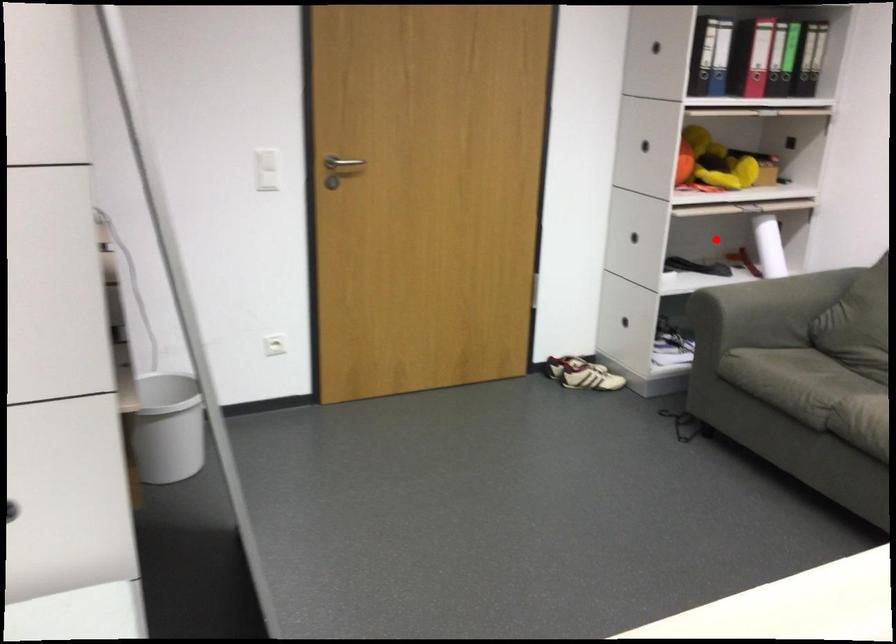
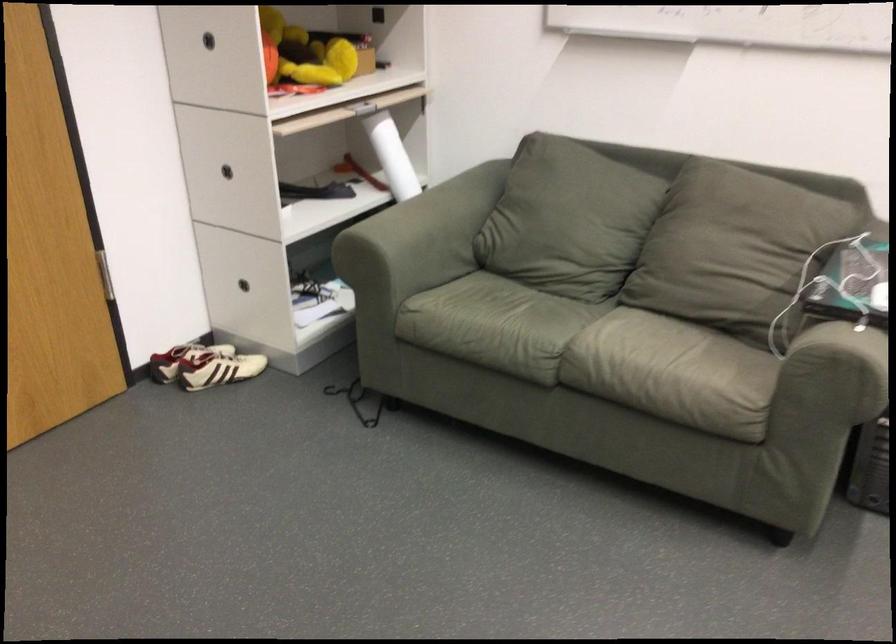
Find the pixel in the second image that matches the highlighted location in the first image.

(330, 161)